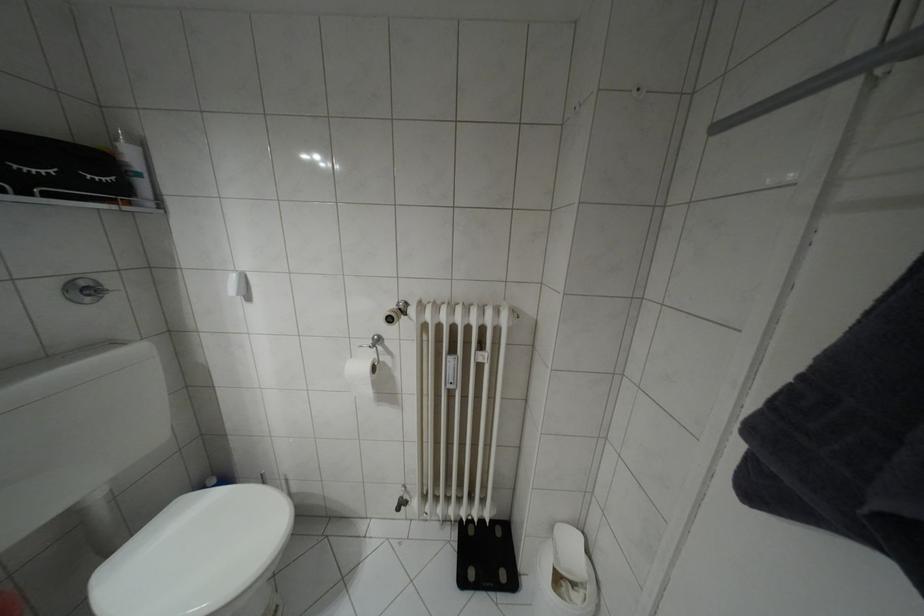
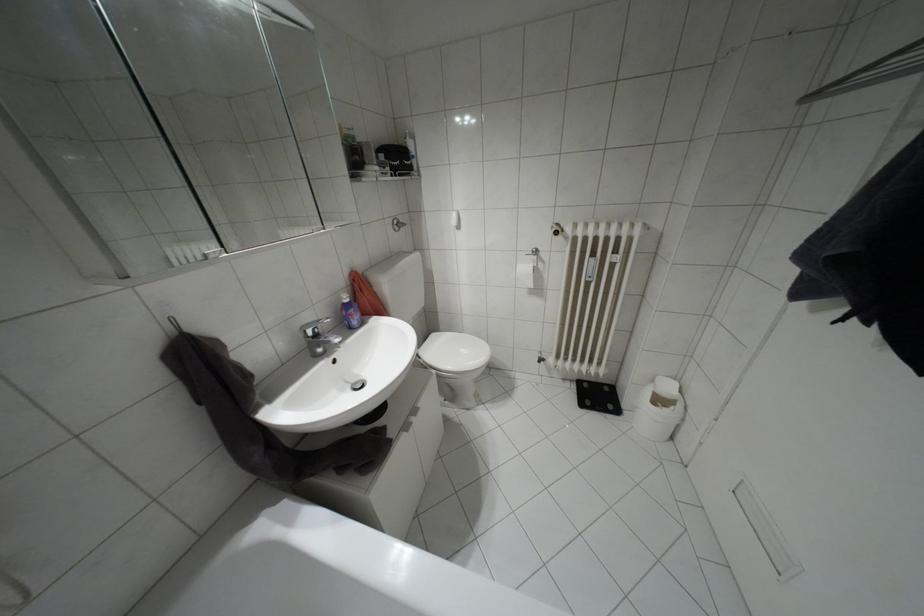
Find the pixel in the second image that matches the point at 462,581 in the first image.

(580, 405)